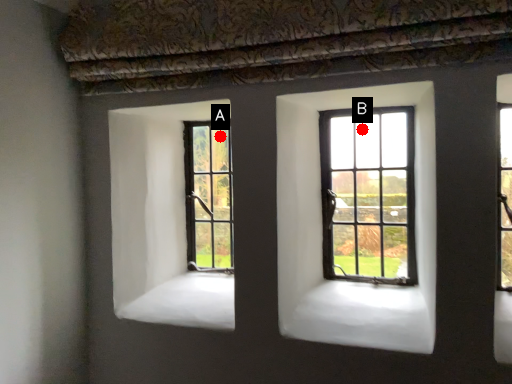
Question: Two points are circled on the image, labeled by A and B beside each circle. Which point is farther from the camera taking this photo?

Choices:
 (A) A is further
 (B) B is further

Answer: (A)